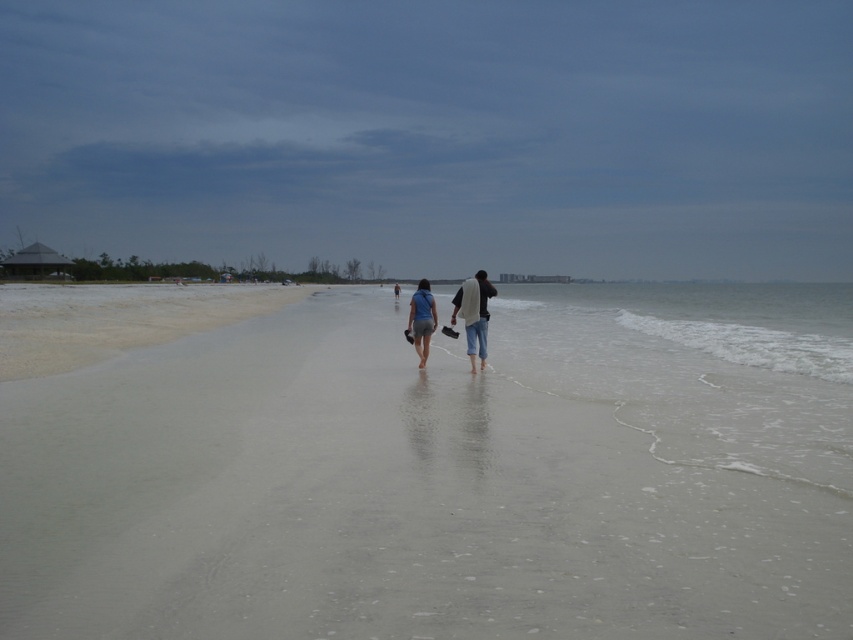
In the scene shown: You are planning to build a small sandcastle on the beach. Which area would be more suitable for building a larger sandcastle, the sandy beach at center or the white sand at lower left?

The white sand at lower left is more suitable for building a larger sandcastle because it has a larger area compared to the sandy beach at center.

You are standing on the sandy beach at center and want to walk to the white sand at lower left. Which direction should you head towards?

Since the sandy beach at center is closer to the viewer than the white sand at lower left, you should head towards the lower left direction to reach the white sand at lower left.